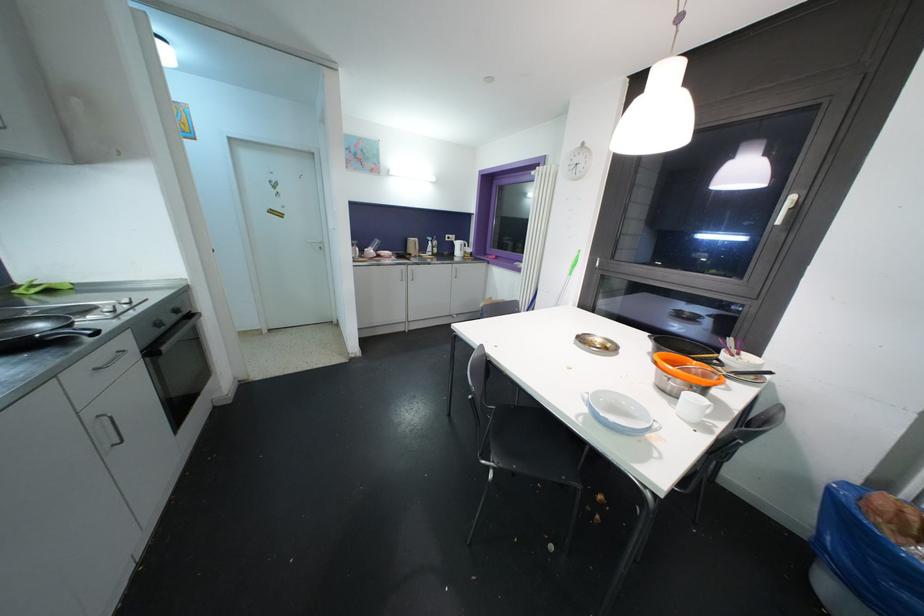
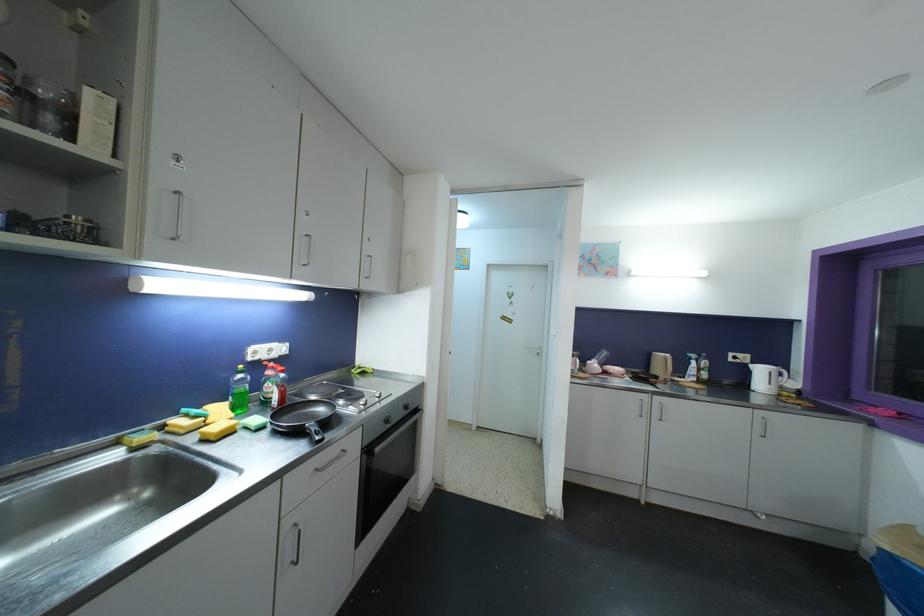
Find the pixel in the second image that matches (460,246) in the first image.

(763, 373)